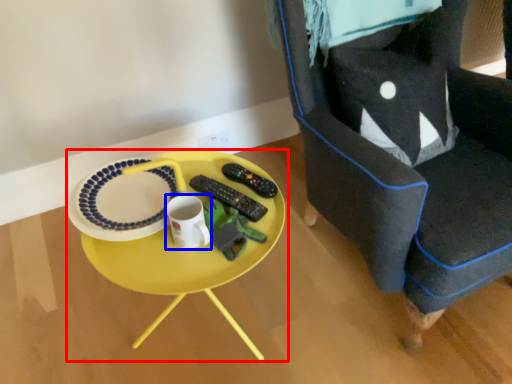
Question: Which of the following is the closest to the observer, table (highlighted by a red box) or coffee cup (highlighted by a blue box)?

Choices:
 (A) table
 (B) coffee cup

Answer: (A)